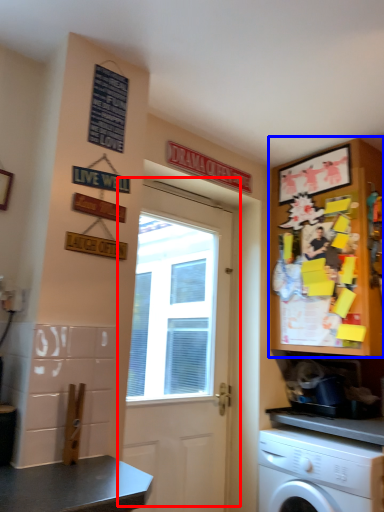
Question: Which point is closer to the camera, door (highlighted by a red box) or cabinetry (highlighted by a blue box)?

Choices:
 (A) door
 (B) cabinetry

Answer: (A)